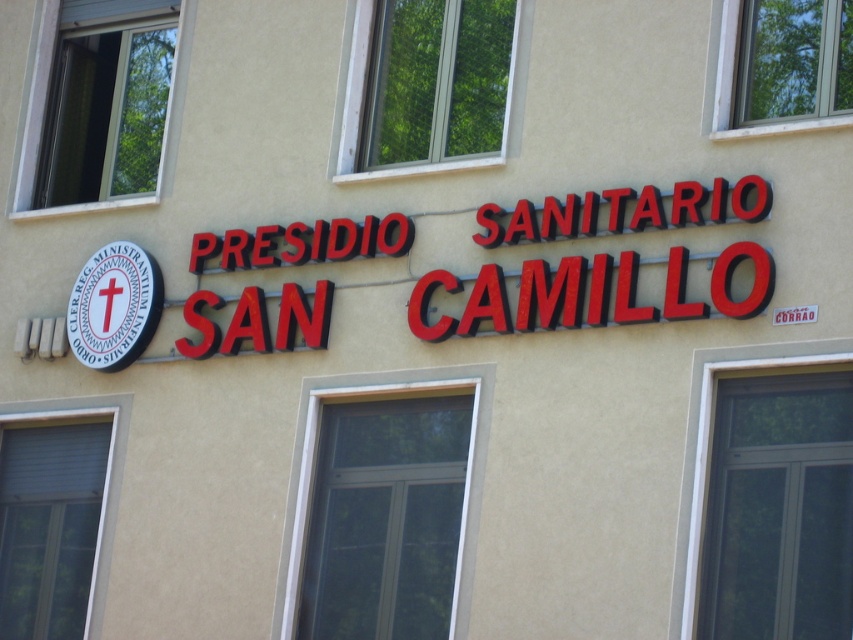
Question: Is red plastic sign at center above white matte circular sign at left?

Choices:
 (A) no
 (B) yes

Answer: (B)

Question: Where is red plastic sign at center located in relation to white matte circular sign at left in the image?

Choices:
 (A) above
 (B) below

Answer: (A)

Question: Is red plastic sign at center wider than white matte circular sign at left?

Choices:
 (A) yes
 (B) no

Answer: (B)

Question: Among these points, which one is nearest to the camera?

Choices:
 (A) (115, 298)
 (B) (496, 221)

Answer: (B)

Question: Among these points, which one is nearest to the camera?

Choices:
 (A) (93, 369)
 (B) (724, 202)

Answer: (B)